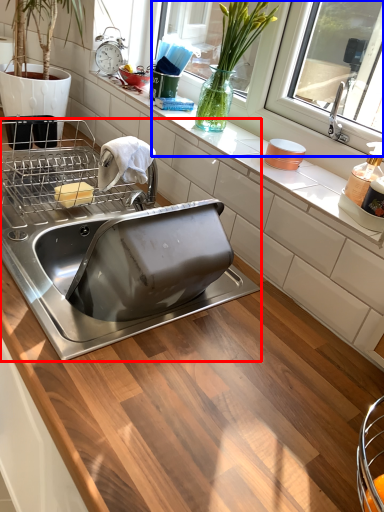
Question: Which of the following is the farthest to the observer, sink (highlighted by a red box) or window screen (highlighted by a blue box)?

Choices:
 (A) sink
 (B) window screen

Answer: (B)